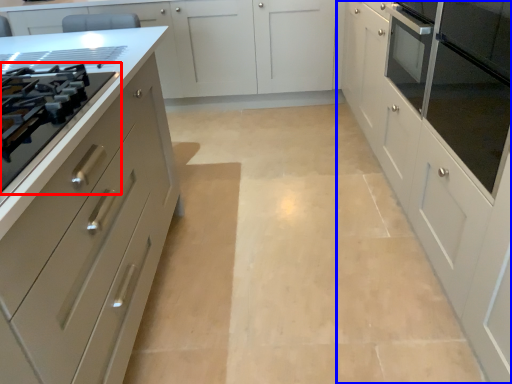
Question: Which object appears farthest to the camera in this image, drawer (highlighted by a red box) or cabinetry (highlighted by a blue box)?

Choices:
 (A) drawer
 (B) cabinetry

Answer: (A)